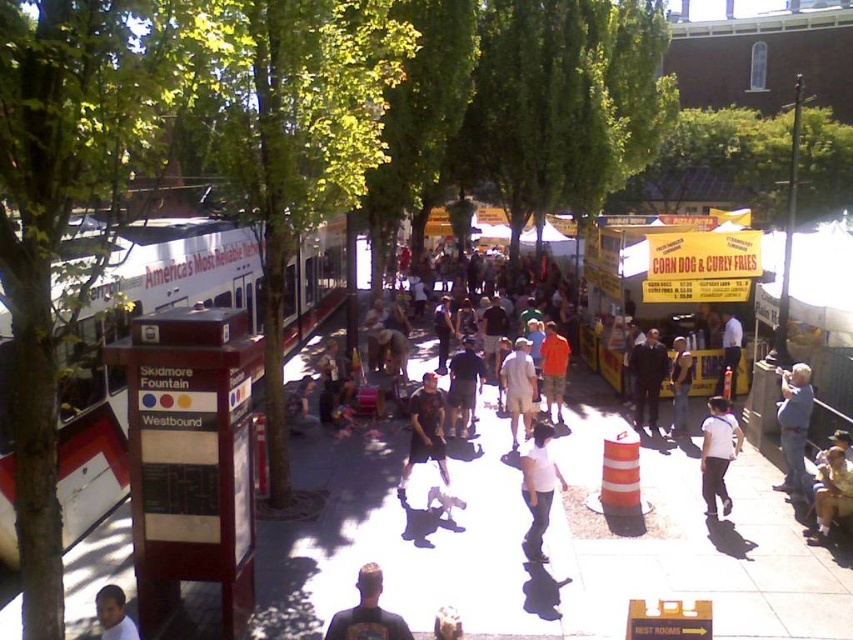
Which is behind, point (102, 625) or point (672, 369)?

The point (672, 369) is more distant.

Describe the element at coordinates (113, 614) in the screenshot. I see `dark blue shirt at lower left` at that location.

Between point (125, 600) and point (674, 420), which one is positioned behind?

Positioned behind is point (674, 420).

At what (x,y) coordinates should I click in order to perform the action: click on dark blue shirt at lower left. Please return your answer as a coordinate pair (x, y). The height and width of the screenshot is (640, 853). Looking at the image, I should click on (113, 614).

Between yellow/yellowish cardboard food truck at center-right and dark blue t-shirt at center, which one has less height?

dark blue t-shirt at center is shorter.

Looking at this image, can you confirm if yellow/yellowish cardboard food truck at center-right is bigger than dark blue t-shirt at center?

Yes.

You are a GUI agent. You are given a task and a screenshot of the screen. Output one action in this format:
    pyautogui.click(x=<x>, y=<y>)
    Task: Click on the yellow/yellowish cardboard food truck at center-right
    
    Given the screenshot: What is the action you would take?
    pyautogui.click(x=666, y=259)

From the picture: Who is taller, dark blue t-shirt at center or dark gray t-shirt at center?

With more height is dark gray t-shirt at center.

Is dark blue t-shirt at center thinner than dark gray t-shirt at center?

Yes, dark blue t-shirt at center is thinner than dark gray t-shirt at center.

The image size is (853, 640). Find the location of `dark blue t-shirt at center`. dark blue t-shirt at center is located at coordinates (367, 612).

You are a GUI agent. You are given a task and a screenshot of the screen. Output one action in this format:
    pyautogui.click(x=<x>, y=<y>)
    Task: Click on the dark blue t-shirt at center
    The height and width of the screenshot is (640, 853).
    Given the screenshot: What is the action you would take?
    pyautogui.click(x=367, y=612)